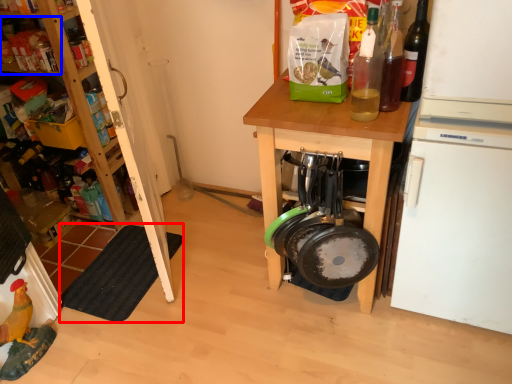
Question: Which point is further to the camera, mat (highlighted by a red box) or shelf (highlighted by a blue box)?

Choices:
 (A) mat
 (B) shelf

Answer: (B)